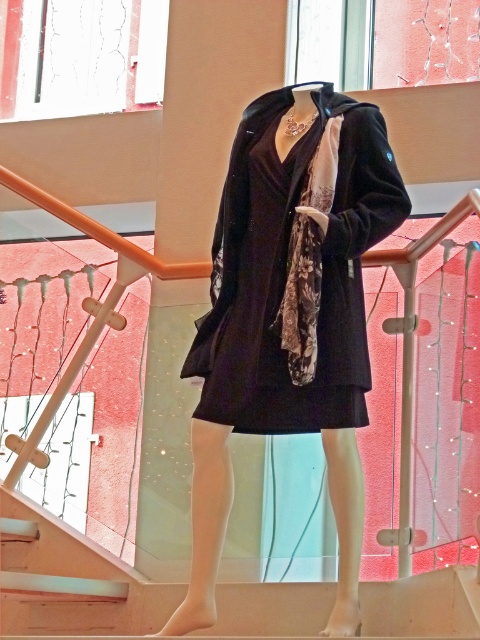
You are a customer in a mall and see the mannequin wearing a floral silk scarf at center and standing on white glossy stairs at lower center. Which object is positioned to the left of the other?

The white glossy stairs at lower center are positioned to the left of the floral silk scarf at center.

You are a customer trying to reach the scarf on the mannequin. The floral silk scarf at center is hanging near the white glossy stairs at lower center. Which object is closer to you if you are standing at the base of the stairs?

The white glossy stairs at lower center is positioned under the floral silk scarf at center, so the scarf is higher up. Therefore, the white glossy stairs at lower center is closer to you when standing at the base.

You are a customer in a clothing store and want to see the details of the velvet black coat at center and the floral silk scarf at center. Which item is easier to examine without moving closer?

The velvet black coat at center is easier to examine without moving closer because it is closer to the viewer than the floral silk scarf at center.